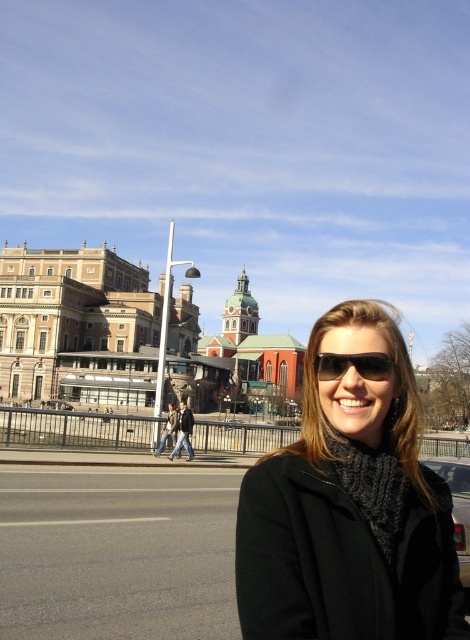
You are a photographer trying to capture the black woolen scarf at center in your shot. The camera has a focus point at coordinates 0.794, 0.745. Will the scarf be in focus?

Yes, the black woolen scarf at center is exactly at the focus point coordinates (350, 508), so it will be in focus.

You are a fashion designer observing the woman in the scene. You need to determine which item is higher on her body between the black woolen scarf at center and the black plastic sunglasses at center. Which one is higher?

The black woolen scarf at center is taller than black plastic sunglasses at center, so the black woolen scarf at center is higher on her body.

You are a delivery person standing at the edge of the street. You need to deliver a package to the black leather jacket at center. However, there is a black matte car at lower right in your way. Can you walk around the car to reach the jacket without crossing the road?

The black matte car at lower right is closer to the viewer than the black leather jacket at center, so you can walk around the car to reach the jacket without needing to cross the road.